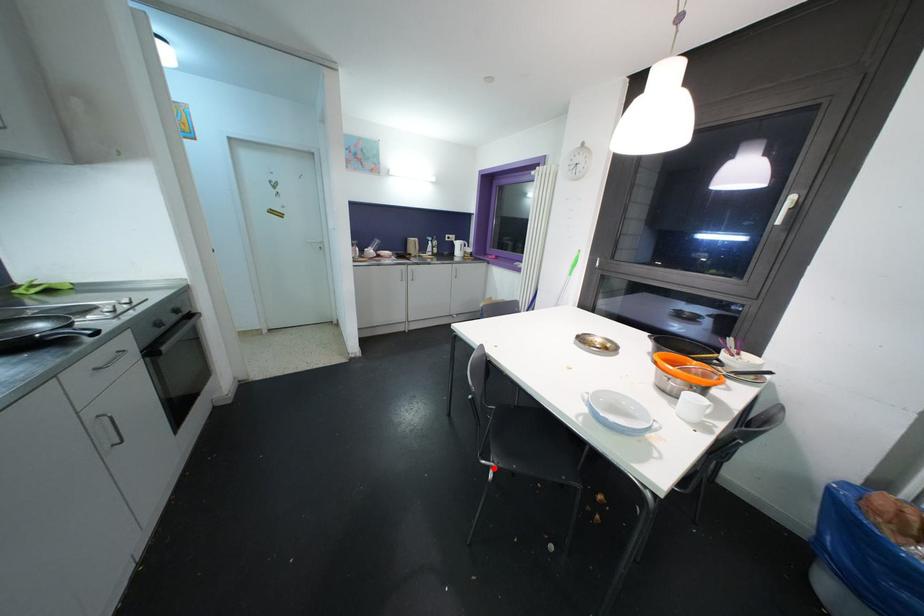
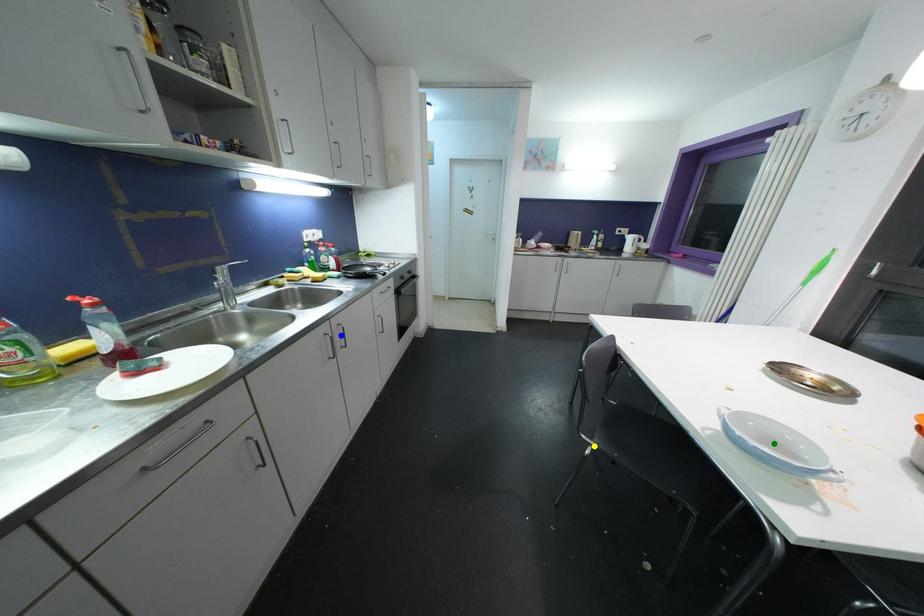
Question: I am providing you with two images of the same scene from different viewpoints. A red point is marked on the first image. You are given multiple points on the second image. Which point in image 2 is actually the same real-world point as the red point in image 1?

Choices:
 (A) yellow point
 (B) blue point
 (C) green point

Answer: (A)